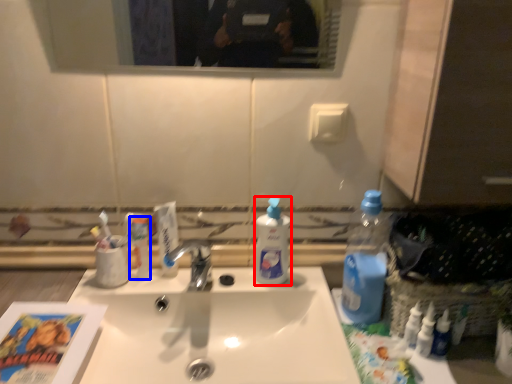
Question: Which object is closer to the camera taking this photo, cleaning product (highlighted by a red box) or toiletry (highlighted by a blue box)?

Choices:
 (A) cleaning product
 (B) toiletry

Answer: (A)